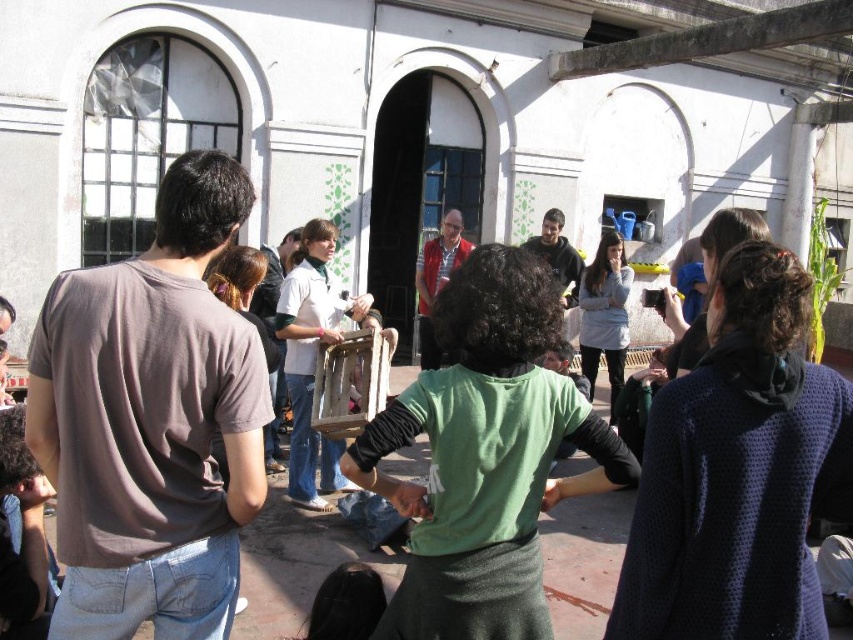
You are standing in the courtyard and want to locate the wooden frame at center. Based on the 2D coordinates provided, where should you look relative to the center of the image?

The wooden frame at center is located at coordinates point 0.561 on the x axis and 0.367 on the y axis, which is slightly to the right and below the center of the image.

You are a photographer trying to capture a photo of the wooden frame at center and the smooth green hand at center. Based on their positions, which object should you focus on first if you want to include both in the same frame without moving the camera?

The wooden frame at center is positioned on the left side of smooth green hand at center, so you should focus on the wooden frame at center first to ensure both are in the same frame without moving the camera.